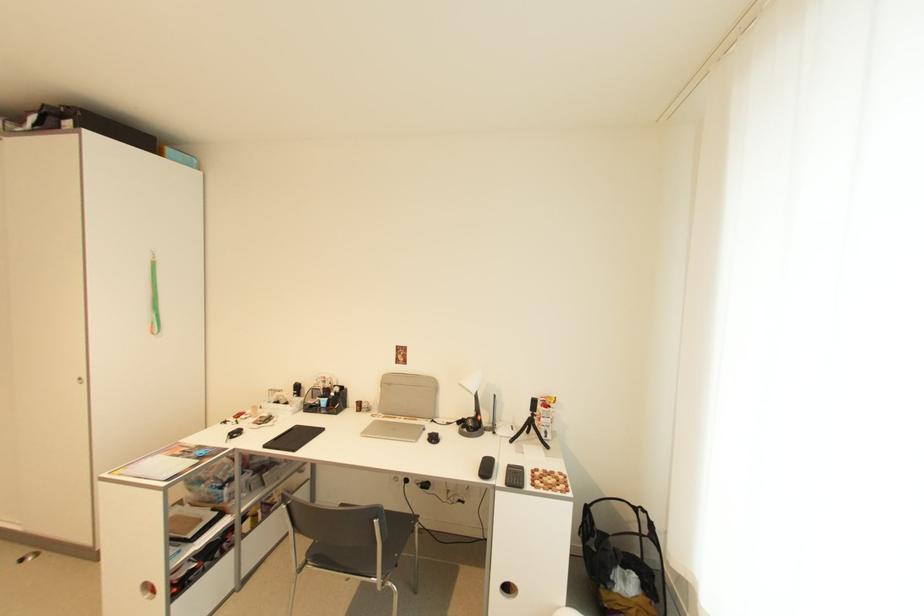
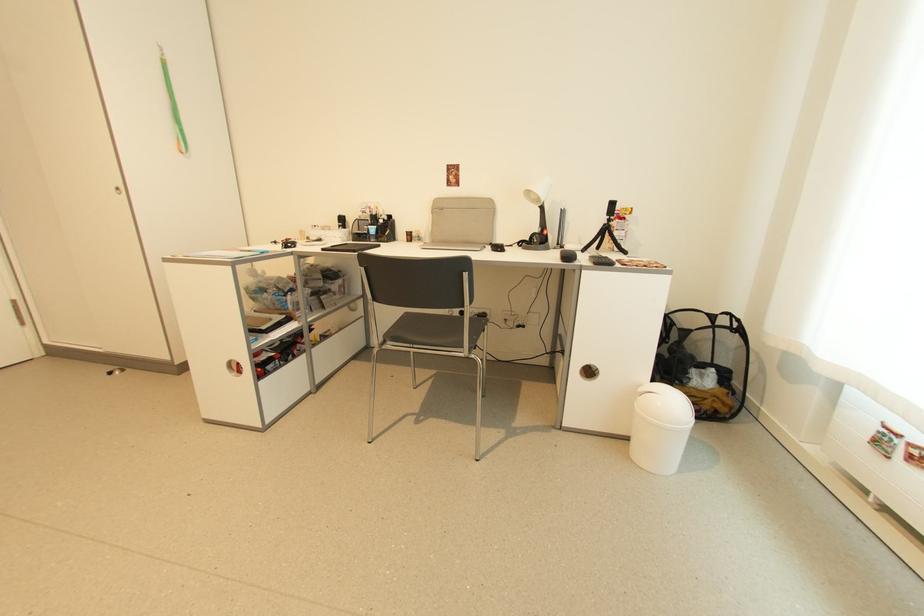
Question: The first image is from the beginning of the video and the second image is from the end. How did the camera likely rotate when shooting the video?

Choices:
 (A) Left
 (B) Right
 (C) Up
 (D) Down

Answer: (D)